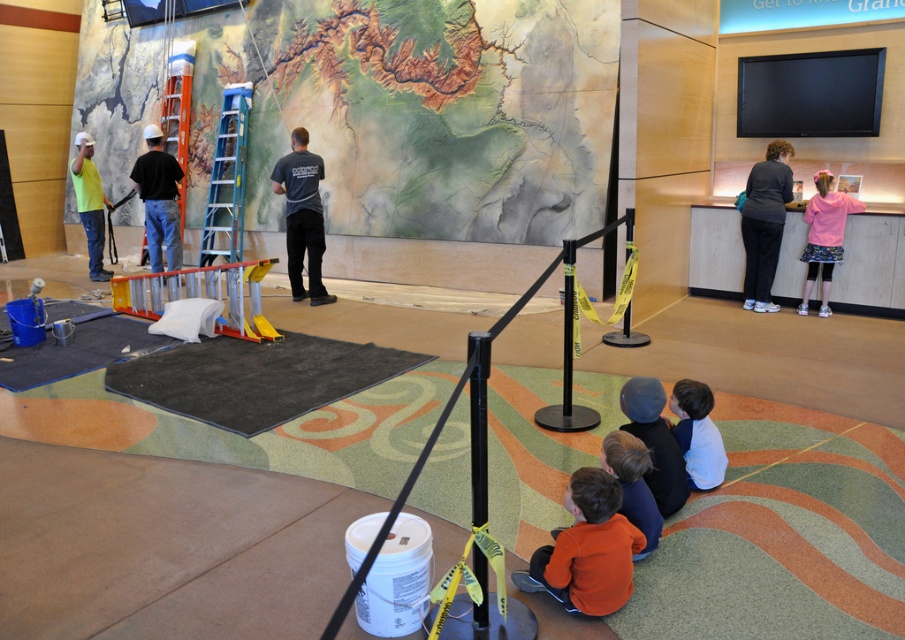
Question: Which of the following is the closest to the observer?

Choices:
 (A) matte black shirt at center
 (B) black fabric at center
 (C) pink fleece jacket at upper right
 (D) dark gray shirt at center

Answer: (C)

Question: Which object is positioned farthest from the white cotton shirt at lower right?

Choices:
 (A) dark gray shirt at center
 (B) black fabric at center

Answer: (A)

Question: Is matte black shirt at center to the left of pink fleece jacket at upper right from the viewer's perspective?

Choices:
 (A) yes
 (B) no

Answer: (A)

Question: Is dark gray shirt at center to the left of matte yellow shirt at left from the viewer's perspective?

Choices:
 (A) yes
 (B) no

Answer: (B)

Question: Considering the real-world distances, which object is farthest from the white cotton shirt at lower right?

Choices:
 (A) pink fleece jacket at upper right
 (B) matte black shirt at center
 (C) orange fleece jacket at lower center

Answer: (B)

Question: Is the position of matte black shirt at center less distant than that of orange cotton shirt at lower center?

Choices:
 (A) yes
 (B) no

Answer: (B)